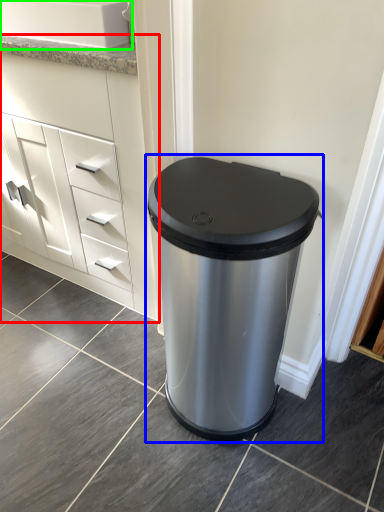
Question: Estimate the real-world distances between objects in this image. Which object is farther from chest of drawers (highlighted by a red box), waste container (highlighted by a blue box) or sink (highlighted by a green box)?

Choices:
 (A) waste container
 (B) sink

Answer: (A)